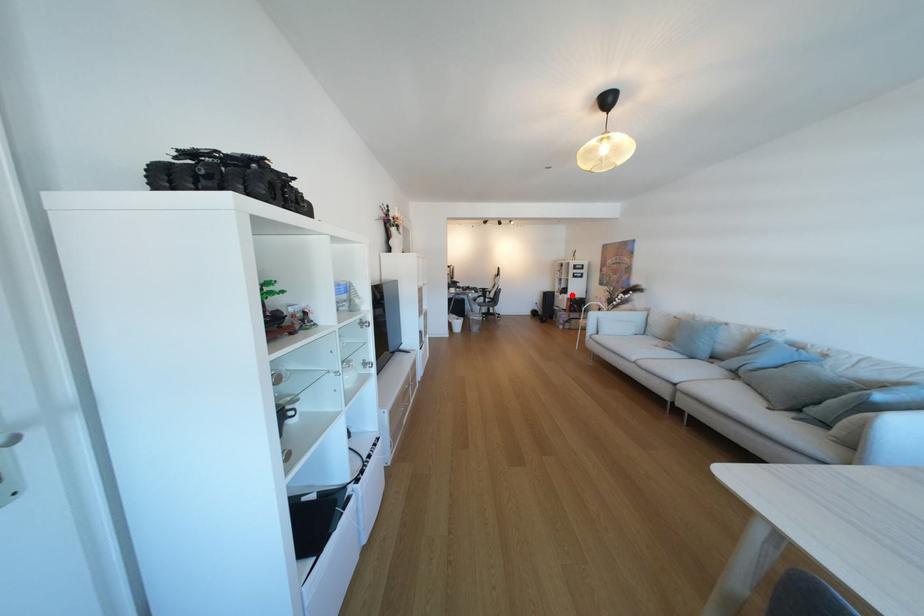
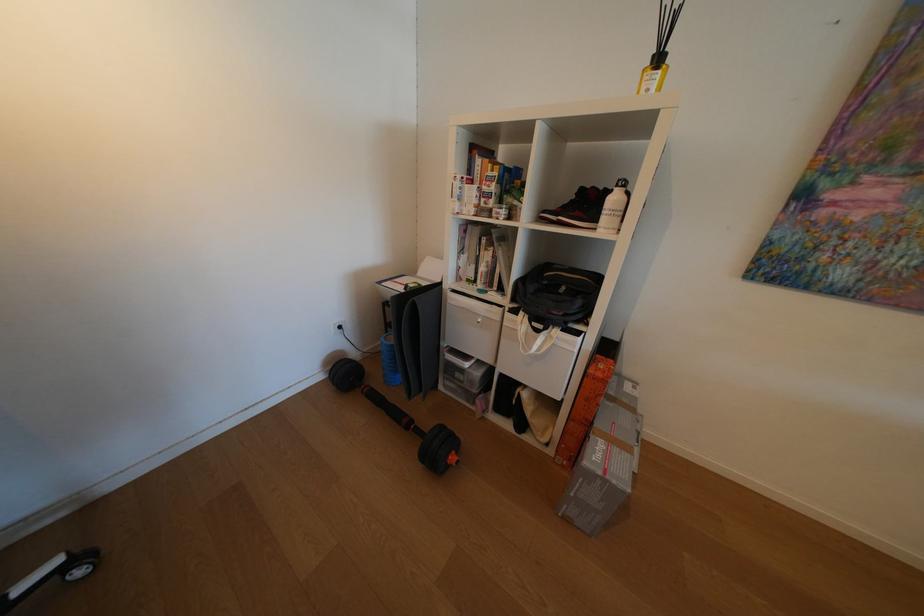
Question: I am providing you with two images of the same scene from different viewpoints. Given a red point in image1, look at the same physical point in image2. Is it:

Choices:
 (A) Closer to the viewpoint
 (B) Farther from the viewpoint

Answer: (B)